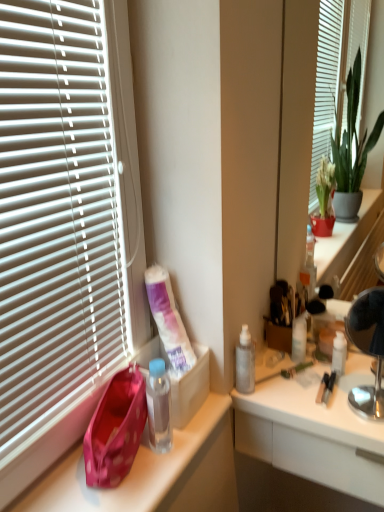
Question: Is white matte tube at lower left smaller than pink fabric handbag at left?

Choices:
 (A) no
 (B) yes

Answer: (A)

Question: Is white matte tube at lower left thinner than pink fabric handbag at left?

Choices:
 (A) yes
 (B) no

Answer: (B)

Question: Is white matte tube at lower left next to pink fabric handbag at left?

Choices:
 (A) no
 (B) yes

Answer: (A)

Question: Is pink fabric handbag at left surrounded by white matte tube at lower left?

Choices:
 (A) no
 (B) yes

Answer: (A)

Question: Does white matte tube at lower left appear on the right side of pink fabric handbag at left?

Choices:
 (A) no
 (B) yes

Answer: (B)

Question: In terms of width, does metallic silver lamp at right look wider or thinner when compared to translucent plastic bottle at upper right?

Choices:
 (A) thin
 (B) wide

Answer: (B)

Question: Considering the positions of point (374, 407) and point (304, 327), is point (374, 407) closer or farther from the camera than point (304, 327)?

Choices:
 (A) farther
 (B) closer

Answer: (B)

Question: In the image, is metallic silver lamp at right positioned in front of or behind translucent plastic bottle at upper right?

Choices:
 (A) behind
 (B) front

Answer: (B)

Question: From a real-world perspective, relative to translucent plastic bottle at upper right, is metallic silver lamp at right vertically above or below?

Choices:
 (A) above
 (B) below

Answer: (A)

Question: Does point (241, 345) appear closer or farther from the camera than point (99, 433)?

Choices:
 (A) farther
 (B) closer

Answer: (A)

Question: Choose the correct answer: Is transparent plastic bottle at center-right inside pink fabric handbag at left or outside it?

Choices:
 (A) outside
 (B) inside

Answer: (A)

Question: Considering the positions of transparent plastic bottle at center-right and pink fabric handbag at left in the image, is transparent plastic bottle at center-right taller or shorter than pink fabric handbag at left?

Choices:
 (A) tall
 (B) short

Answer: (A)

Question: From the image's perspective, is transparent plastic bottle at center-right located above or below pink fabric handbag at left?

Choices:
 (A) below
 (B) above

Answer: (B)

Question: Choose the correct answer: Is transparent plastic bottle at center-right inside metallic silver lamp at right or outside it?

Choices:
 (A) inside
 (B) outside

Answer: (B)

Question: In the image, is transparent plastic bottle at center-right positioned in front of or behind metallic silver lamp at right?

Choices:
 (A) front
 (B) behind

Answer: (B)